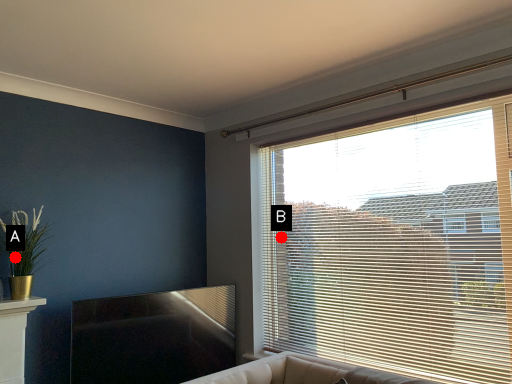
Question: Two points are circled on the image, labeled by A and B beside each circle. Among these points, which one is nearest to the camera?

Choices:
 (A) A is closer
 (B) B is closer

Answer: (A)